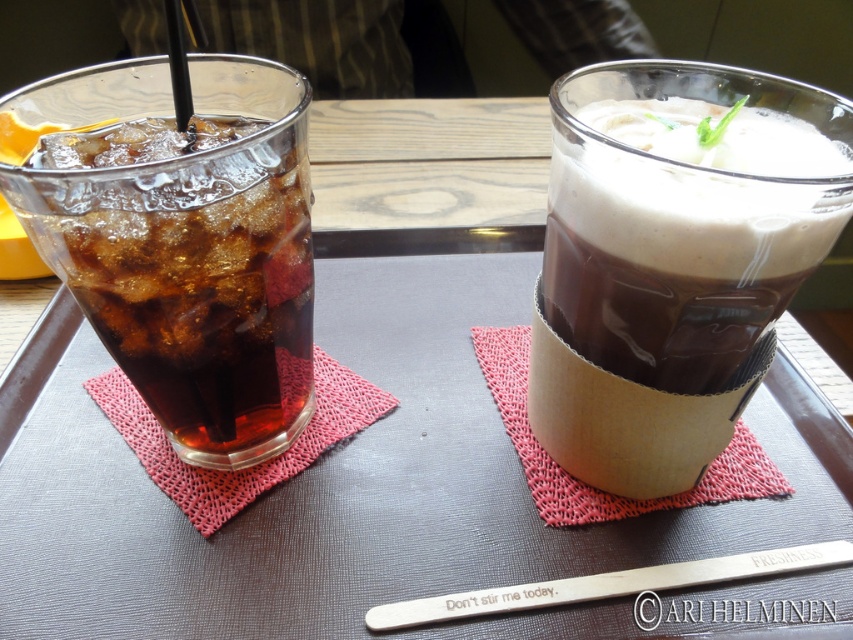
Question: Does smooth chocolate milkshake at center appear under translucent glass at left?

Choices:
 (A) yes
 (B) no

Answer: (B)

Question: Considering the relative positions of smooth chocolate milkshake at center and translucent glass at left in the image provided, where is smooth chocolate milkshake at center located with respect to translucent glass at left?

Choices:
 (A) below
 (B) above

Answer: (B)

Question: In this image, where is smooth chocolate milkshake at center located relative to translucent glass at left?

Choices:
 (A) below
 (B) above

Answer: (B)

Question: Which of the following is the farthest from the observer?

Choices:
 (A) translucent glass at left
 (B) smooth chocolate milkshake at center

Answer: (A)

Question: Which point is closer to the camera?

Choices:
 (A) translucent glass at left
 (B) smooth chocolate milkshake at center

Answer: (B)